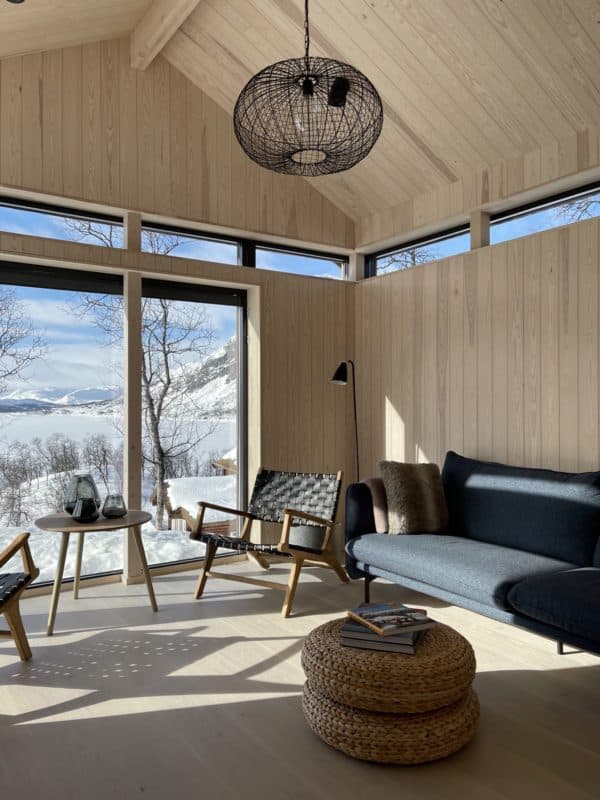
At what (x,y) coordinates should I click in order to perform the action: click on pitcher. Please return your answer as a coordinate pair (x, y). The height and width of the screenshot is (800, 600). Looking at the image, I should click on (85, 486).